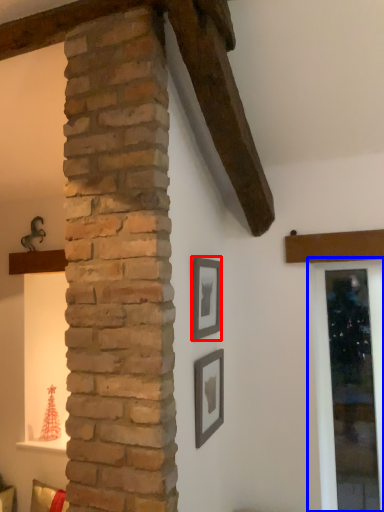
Question: Which object is closer to the camera taking this photo, picture frame (highlighted by a red box) or window frame (highlighted by a blue box)?

Choices:
 (A) picture frame
 (B) window frame

Answer: (A)